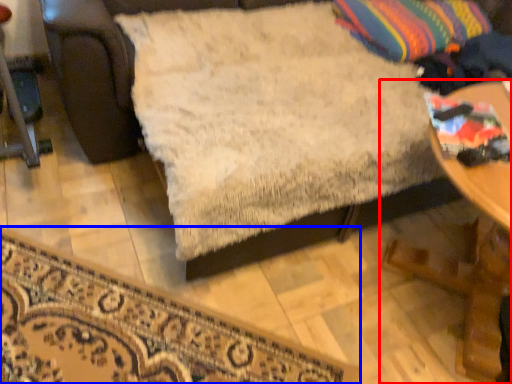
Question: Which of the following is the closest to the observer, table (highlighted by a red box) or furniture (highlighted by a blue box)?

Choices:
 (A) table
 (B) furniture

Answer: (A)